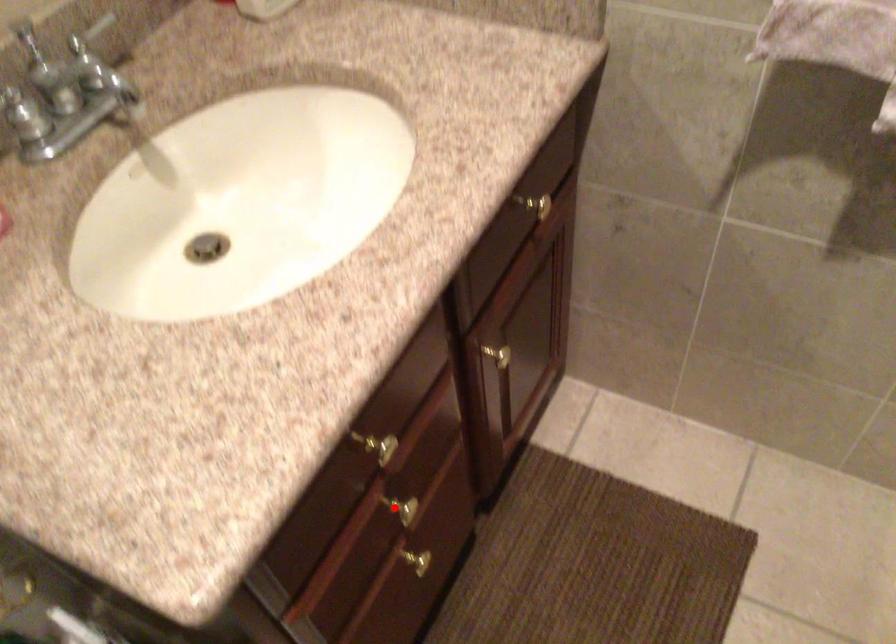
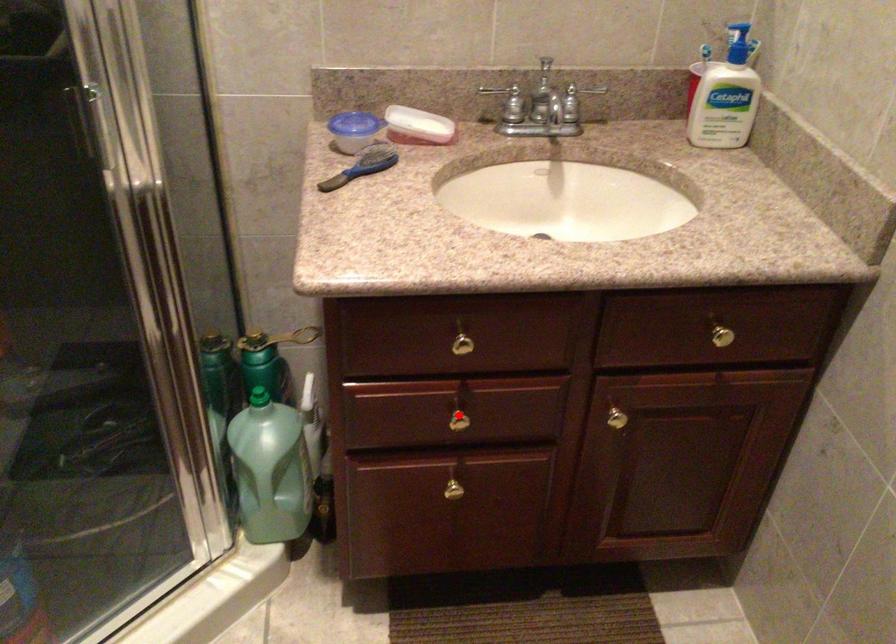
I am providing you with two images of the same scene from different viewpoints. A red point is marked on the first image and another point is marked on the second image. Is the red point in image1 aligned with the point shown in image2?

Yes